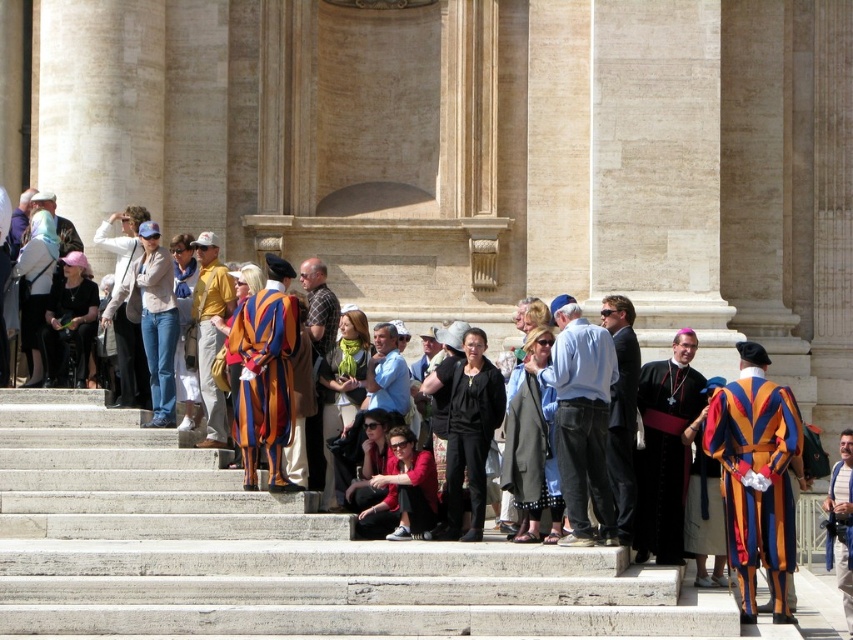
Question: Which of the following is the closest to the observer?

Choices:
 (A) blue striped shirt at center
 (B) concrete stairs at center
 (C) yellow cotton shirt at center
 (D) matte black robe at center

Answer: (B)

Question: Is matte black robe at center to the left of striped velvet robe at center from the viewer's perspective?

Choices:
 (A) yes
 (B) no

Answer: (B)

Question: Is multicolored velvet robe at right below gray wool coat at center?

Choices:
 (A) no
 (B) yes

Answer: (B)

Question: Is the position of multicolored velvet robe at right more distant than that of blue denim jeans at center?

Choices:
 (A) yes
 (B) no

Answer: (B)

Question: Which point appears closest to the camera in this image?

Choices:
 (A) (659, 488)
 (B) (323, 308)
 (C) (773, 461)
 (D) (585, 403)

Answer: (C)

Question: Considering the real-world distances, which object is farthest from the concrete stairs at center?

Choices:
 (A) matte black robe at center
 (B) dark gray suit at center
 (C) blue denim jeans at center

Answer: (A)